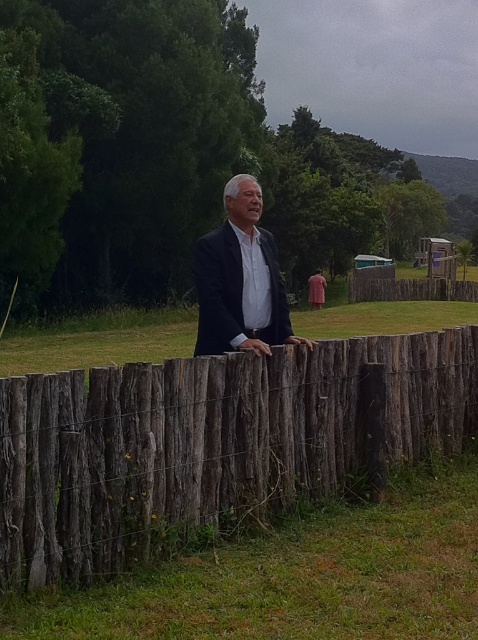
This screenshot has height=640, width=478. Describe the element at coordinates (240, 280) in the screenshot. I see `matte black suit at center` at that location.

Can you confirm if matte black suit at center is positioned above pink fabric at center?

No.

Is point (235, 317) closer to viewer compared to point (315, 291)?

Yes.

Where is `matte black suit at center`? The image size is (478, 640). matte black suit at center is located at coordinates (240, 280).

Is weathered wood fence at center taller than pink fabric at center?

Result: No.

Locate an element on the screen. weathered wood fence at center is located at coordinates (214, 444).

Where is `weathered wood fence at center`? The image size is (478, 640). weathered wood fence at center is located at coordinates (214, 444).

Is weathered wood fence at center wider than matte black suit at center?

Yes.

Is point (252, 403) positioned behind point (207, 236)?

No, it is in front of (207, 236).

Describe the element at coordinates (214, 444) in the screenshot. I see `weathered wood fence at center` at that location.

The width and height of the screenshot is (478, 640). Find the location of `weathered wood fence at center`. weathered wood fence at center is located at coordinates (214, 444).